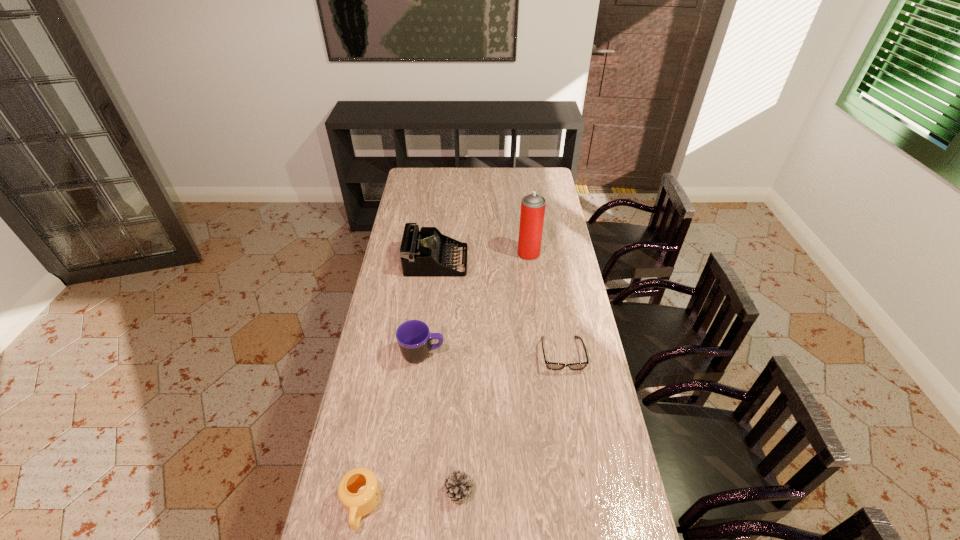
Find the location of `object that stands as the fourth closest to the aerosol can`. object that stands as the fourth closest to the aerosol can is located at coordinates (458, 485).

Locate which object ranks second in proximity to the shortest object. Please provide its 2D coordinates. Your answer should be formatted as a tuple, i.e. [(x, y)], where the tuple contains the x and y coordinates of a point satisfying the conditions above.

[(423, 254)]

You are a GUI agent. You are given a task and a screenshot of the screen. Output one action in this format:
    pyautogui.click(x=<x>, y=<y>)
    Task: Click on the vacant space that satisfies the following two spatial constraints: 1. on the front side of the aerosol can; 2. with the handle on the side of the third tallest object
    
    Given the screenshot: What is the action you would take?
    pyautogui.click(x=541, y=354)

Find the location of `free space in the image that satisfies the following two spatial constraints: 1. with the handle on the side of the pinecone; 2. on the left side of the farther mug`. free space in the image that satisfies the following two spatial constraints: 1. with the handle on the side of the pinecone; 2. on the left side of the farther mug is located at coordinates (406, 491).